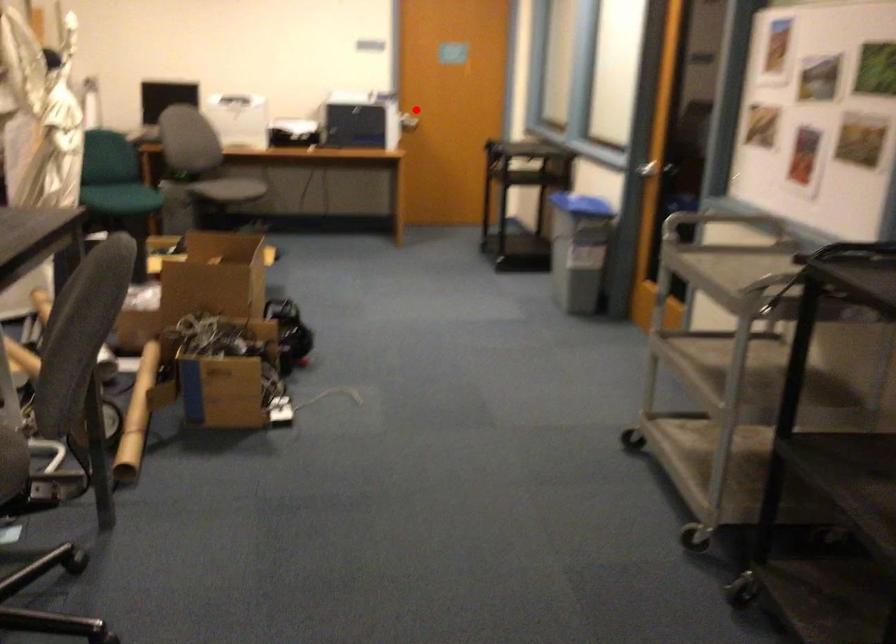
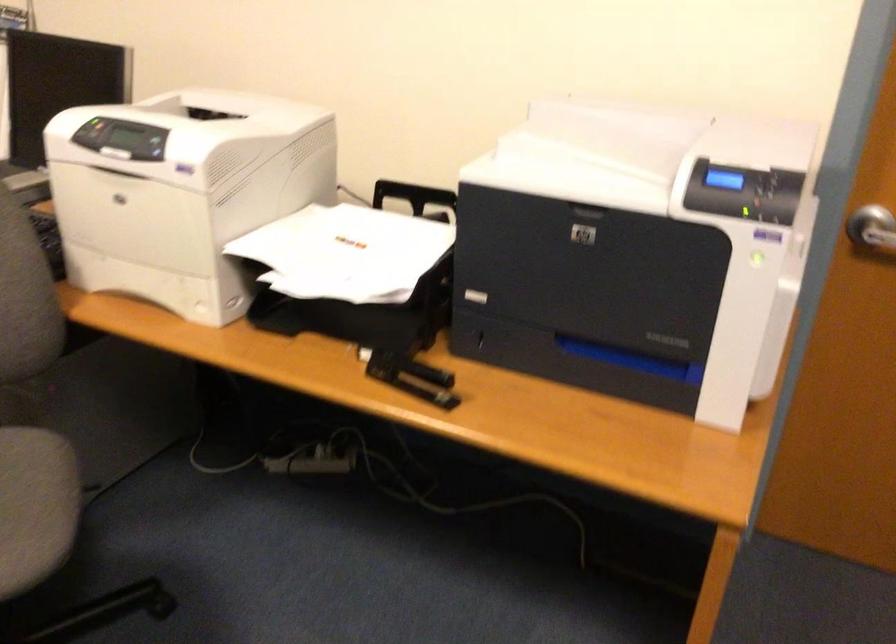
Question: A red point is marked in image1. In image2, is the corresponding 3D point closer to the camera or farther? Reply with the corresponding letter.

Choices:
 (A) The corresponding 3D point is closer.
 (B) The corresponding 3D point is farther.

Answer: (A)